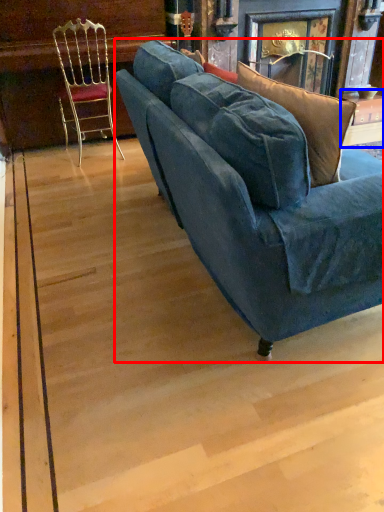
Question: Which object appears farthest to the camera in this image, studio couch (highlighted by a red box) or table (highlighted by a blue box)?

Choices:
 (A) studio couch
 (B) table

Answer: (B)